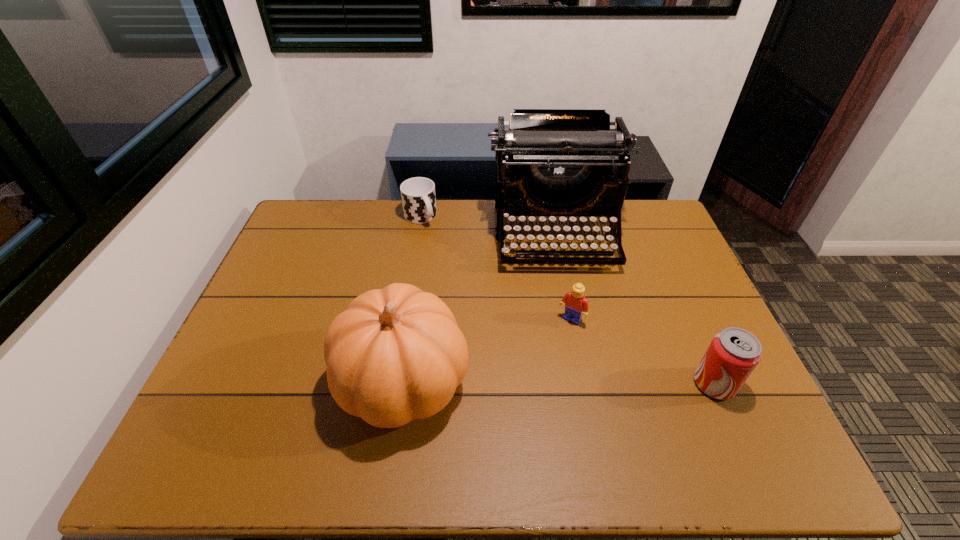
Locate an element on the screen. The image size is (960, 540). free spot on the desktop that is between the pumpkin and the rightmost object and is positioned on the side of the cup with the handle is located at coordinates (547, 382).

At what (x,y) coordinates should I click in order to perform the action: click on vacant spot on the desktop that is between the pumpkin and the rightmost object and is positioned on the front-facing side of the Lego. Please return your answer as a coordinate pair (x, y). Image resolution: width=960 pixels, height=540 pixels. Looking at the image, I should click on (528, 382).

What are the coordinates of `vacant space on the desktop that is between the fourth shortest object and the soda can and is positioned on the typing side of the tallest object` in the screenshot? It's located at (582, 383).